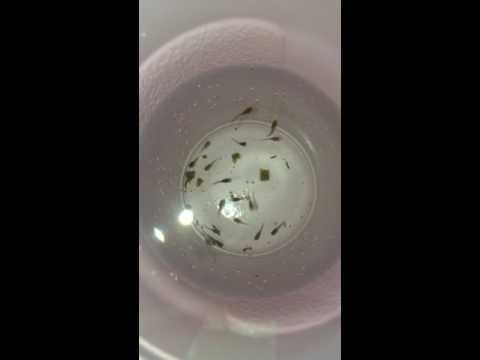
This screenshot has width=480, height=360. Identify the location of bottom of white bowl. (227, 130), (298, 154), (297, 225), (238, 245), (190, 193).